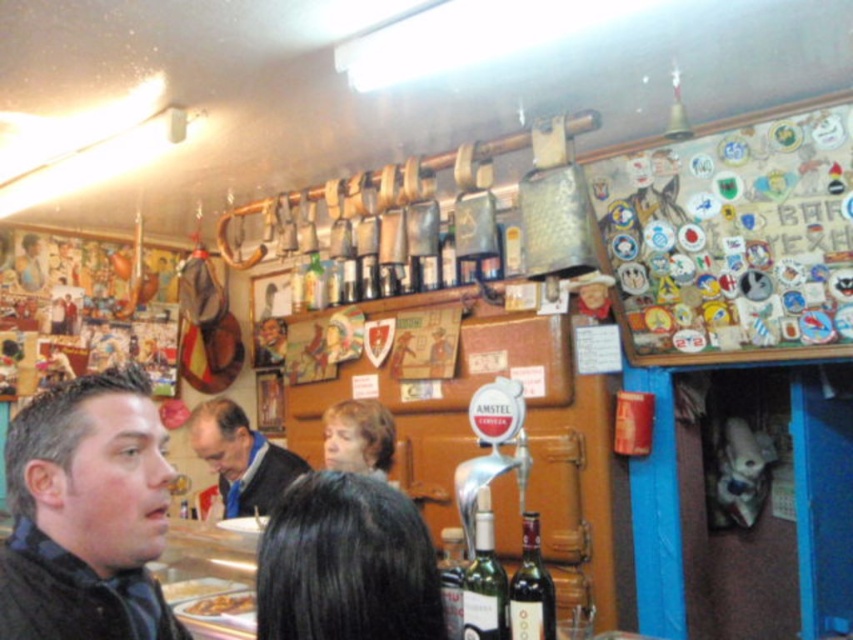
Looking at this image, you are at the bar and want to order a drink. The bartender asks you to point to the item you want using coordinates. You want the item at point (86,513). What item do you want?

The point (86,513) corresponds to the dark gray sweater at lower left.

You are a customer in this bar and want to order a drink. You notice two people at the counter, one wearing a dark gray sweater at lower left and another with light brown hair at center. Which person is closer to the bar counter?

The dark gray sweater at lower left is much taller than the light brown hair at center, so the person in the dark gray sweater at lower left is closer to the bar counter because taller individuals are usually positioned closer to the counter when standing.

You are a customer at the bar and want to grab both the blue fabric shirt at center and the green glass bottle at center. Which one should you reach for first if you want to pick up the one closer to your right hand?

The green glass bottle at center is on the right side of the blue fabric shirt at center, so you should reach for the green glass bottle at center first.